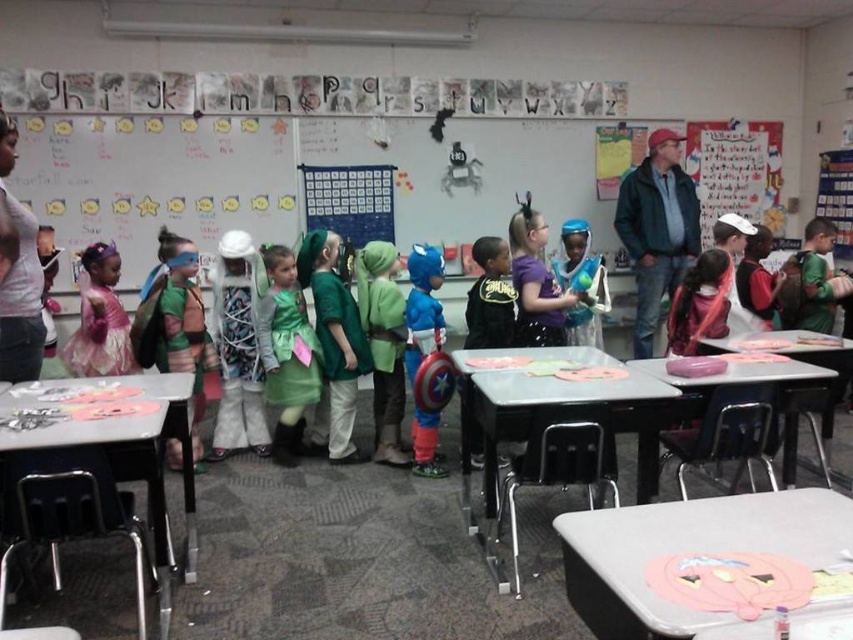
You are a photographer in the classroom and want to capture both the shiny blue costume at center and the black matte superhero costume at center in a single photo. Which costume should you focus on first to ensure both are in frame?

The shiny blue costume at center is larger in size compared to the black matte superhero costume at center, so you should focus on the shiny blue costume at center first to ensure both are in frame.

You are a photographer trying to capture a group photo of the children in the classroom. You notice the green fabric costume at center and the black matte superhero costume at center. Considering their heights, which costume will appear larger in the photo?

The green fabric costume at center is much taller than the black matte superhero costume at center, so it will appear larger in the photo.

You are a student in the classroom and want to move from point A to point B. Point A is at coordinates point (349, 296) and point B is at coordinates point (488, 248). Which direction should you move to go from point A to point B?

To move from point A at coordinates point (349, 296) to point B at coordinates point (488, 248), you should move towards the upper left direction since point A is behind point B.